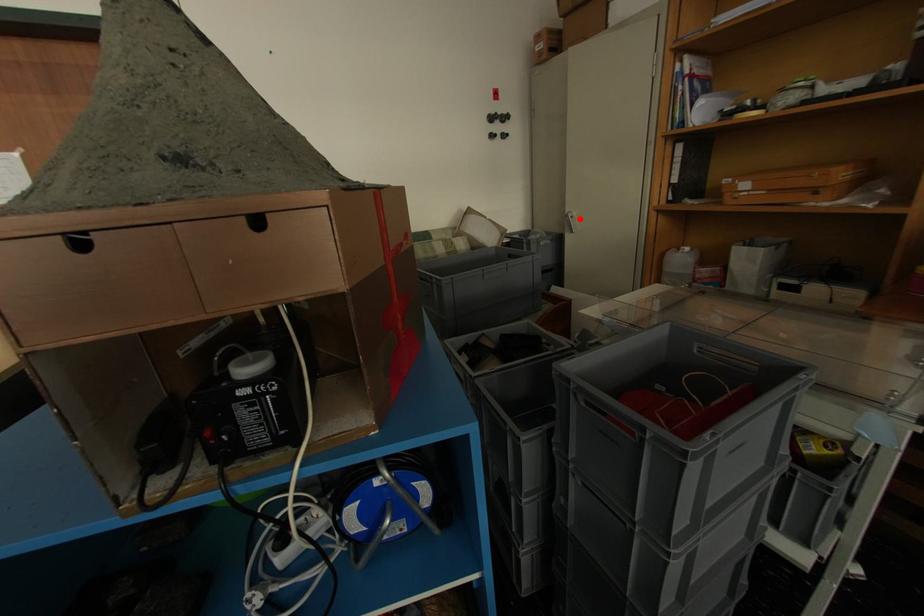
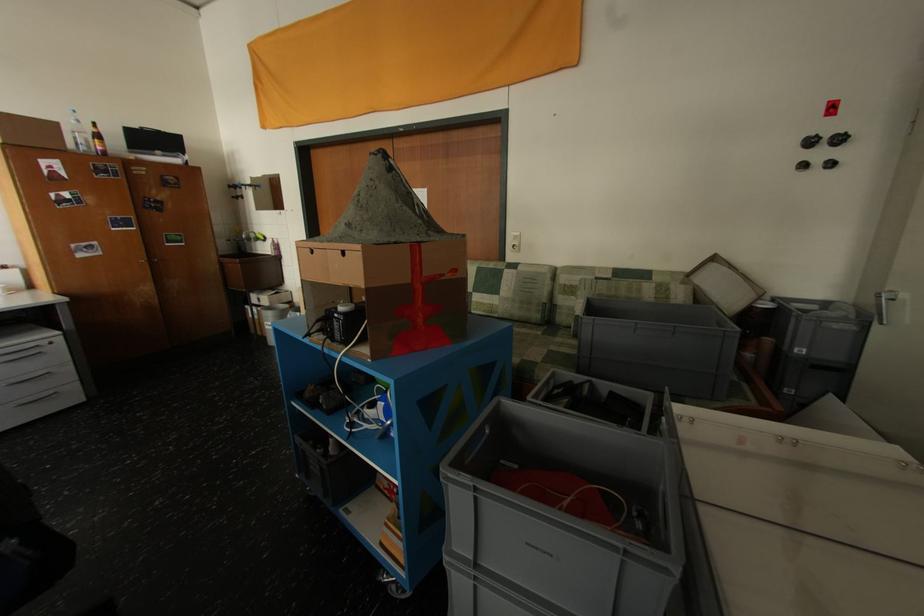
Question: I am providing you with two images of the same scene from different viewpoints. In image1, a red point is highlighted. Considering the same 3D point in image2, which of the following is correct?

Choices:
 (A) It is closer
 (B) It is farther

Answer: (B)